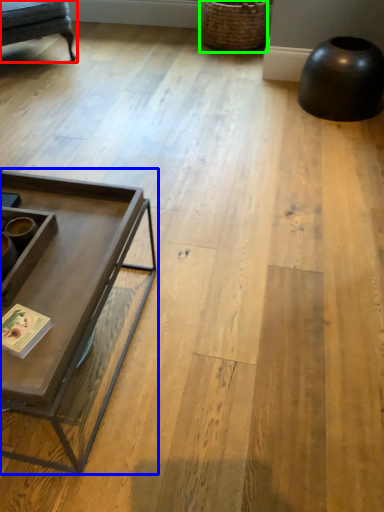
Question: Estimate the real-world distances between objects in this image. Which object is closer to swivel chair (highlighted by a red box), coffee table (highlighted by a blue box) or basket (highlighted by a green box)?

Choices:
 (A) coffee table
 (B) basket

Answer: (B)